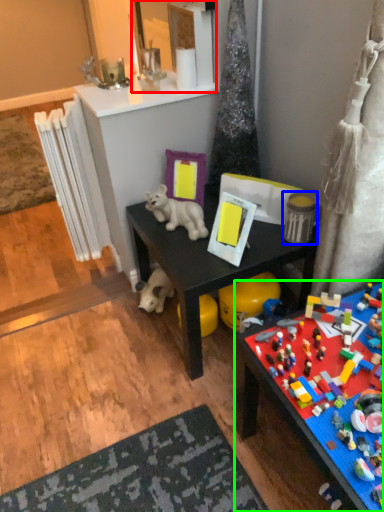
Question: Which object is positioned closest to mirror (highlighted by a red box)? Select from toy (highlighted by a blue box) and toy (highlighted by a green box).

Choices:
 (A) toy
 (B) toy

Answer: (A)